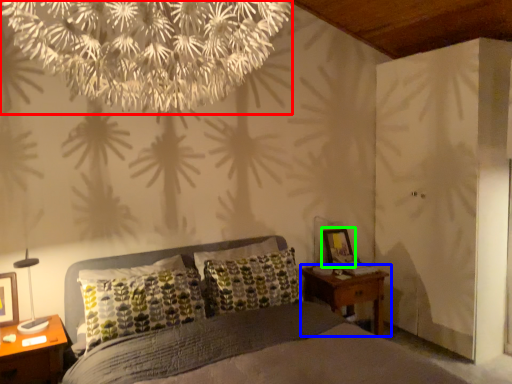
Question: Considering the real-world distances, which object is farthest from flower (highlighted by a red box)? nightstand (highlighted by a blue box) or picture frame (highlighted by a green box)?

Choices:
 (A) nightstand
 (B) picture frame

Answer: (B)